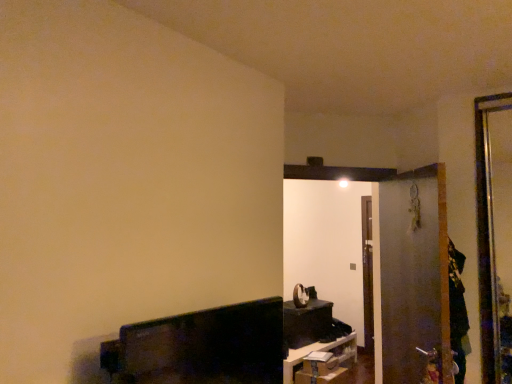
Question: Is matte black clock at center, the 3th furniture in the front-to-back sequence, outside matte black tv at lower left, which is counted as the 3th furniture, starting from the bottom?

Choices:
 (A) yes
 (B) no

Answer: (A)

Question: Can you confirm if matte black clock at center, the 3th furniture in the front-to-back sequence, is taller than matte black tv at lower left, the first furniture viewed from the front?

Choices:
 (A) no
 (B) yes

Answer: (B)

Question: Considering the relative sizes of matte black clock at center, the second furniture positioned from the top, and matte black tv at lower left, the third furniture positioned from the back, in the image provided, is matte black clock at center, the second furniture positioned from the top, thinner than matte black tv at lower left, the third furniture positioned from the back,?

Choices:
 (A) no
 (B) yes

Answer: (A)

Question: From the image's perspective, does matte black clock at center, which appears as the 1th furniture when viewed from the back, appear higher than matte black tv at lower left, which is counted as the 3th furniture, starting from the bottom?

Choices:
 (A) no
 (B) yes

Answer: (A)

Question: Does matte black clock at center, which appears as the 1th furniture when viewed from the back, have a greater width compared to matte black tv at lower left, the third furniture positioned from the back?

Choices:
 (A) no
 (B) yes

Answer: (B)

Question: Is matte black clock at center, the 3th furniture in the front-to-back sequence, to the left of matte black tv at lower left, which appears as the 1th furniture when viewed from the top, from the viewer's perspective?

Choices:
 (A) no
 (B) yes

Answer: (A)

Question: Can you confirm if matte black clock at center, the 3th furniture in the front-to-back sequence, is bigger than matte black shelf at lower center, which is the first furniture from bottom to top?

Choices:
 (A) no
 (B) yes

Answer: (A)

Question: Considering the relative sizes of matte black clock at center, which is the second furniture in bottom-to-top order, and matte black shelf at lower center, arranged as the 2th furniture when viewed from the back, in the image provided, is matte black clock at center, which is the second furniture in bottom-to-top order, smaller than matte black shelf at lower center, arranged as the 2th furniture when viewed from the back,?

Choices:
 (A) yes
 (B) no

Answer: (A)

Question: Can you confirm if matte black clock at center, the 3th furniture in the front-to-back sequence, is thinner than matte black shelf at lower center, which appears as the 3th furniture when viewed from the top?

Choices:
 (A) no
 (B) yes

Answer: (B)

Question: Is matte black clock at center, the 3th furniture in the front-to-back sequence, outside matte black shelf at lower center, which is the first furniture from bottom to top?

Choices:
 (A) yes
 (B) no

Answer: (A)

Question: From the image's perspective, would you say matte black clock at center, which appears as the 1th furniture when viewed from the back, is shown under matte black shelf at lower center, the second furniture in the front-to-back sequence?

Choices:
 (A) yes
 (B) no

Answer: (B)

Question: Is the depth of matte black clock at center, the 3th furniture in the front-to-back sequence, greater than that of matte black shelf at lower center, which appears as the 3th furniture when viewed from the top?

Choices:
 (A) yes
 (B) no

Answer: (A)

Question: From a real-world perspective, does transparent plastic screen door at right sit lower than matte black shelf at lower center, arranged as the 2th furniture when viewed from the back?

Choices:
 (A) no
 (B) yes

Answer: (A)